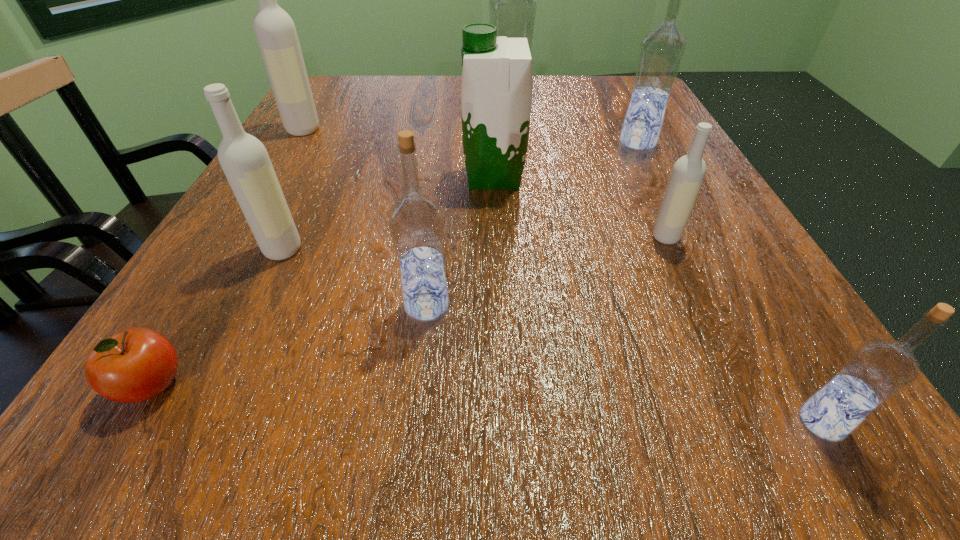
Find the location of a particular element. The width and height of the screenshot is (960, 540). blue vodka that can be found as the second closest to the shortest object is located at coordinates (877, 370).

Where is `the second closest blue vodka relative to the seventh farthest object`? The width and height of the screenshot is (960, 540). the second closest blue vodka relative to the seventh farthest object is located at coordinates (x=661, y=53).

Identify which white vodka is located as the nearest to the shortest object. Please provide its 2D coordinates. Your answer should be formatted as a tuple, i.e. [(x, y)], where the tuple contains the x and y coordinates of a point satisfying the conditions above.

[(246, 164)]

Identify which white vodka is located as the nearest to the fourth farthest object. Please provide its 2D coordinates. Your answer should be formatted as a tuple, i.e. [(x, y)], where the tuple contains the x and y coordinates of a point satisfying the conditions above.

[(688, 172)]

Locate an element on the screen. vacant area in the image that satisfies the following two spatial constraints: 1. on the back side of the biggest blue vodka; 2. on the right side of the shortest object is located at coordinates point(314,114).

I want to click on vacant space that satisfies the following two spatial constraints: 1. on the front side of the second biggest blue vodka; 2. on the right side of the leftmost vodka, so click(x=296, y=143).

Locate an element on the screen. vacant region that satisfies the following two spatial constraints: 1. on the front side of the third nearest blue vodka; 2. on the right side of the farthest white vodka is located at coordinates (x=296, y=143).

The image size is (960, 540). I want to click on free space that satisfies the following two spatial constraints: 1. on the front-facing side of the sixth nearest object; 2. on the back side of the nearest blue vodka, so click(x=504, y=422).